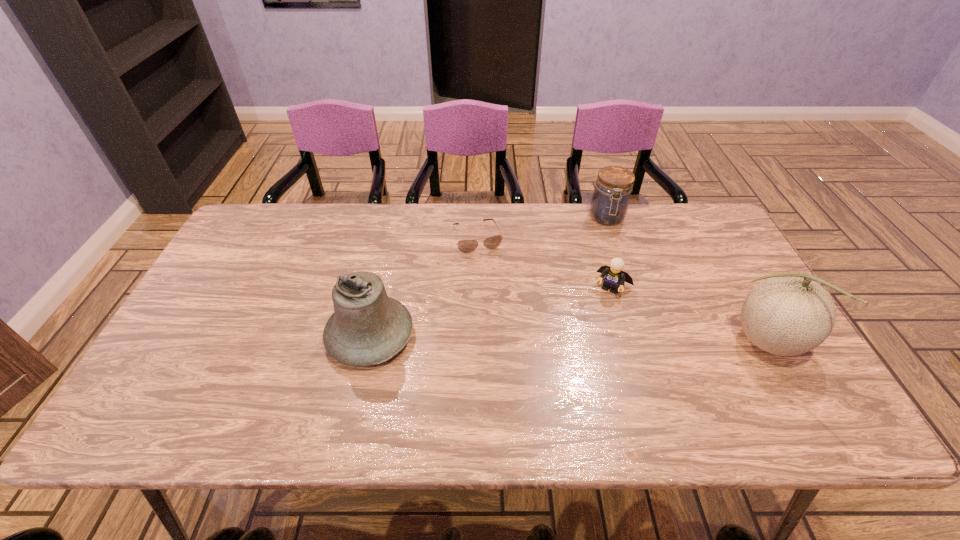
The width and height of the screenshot is (960, 540). I want to click on the fourth shortest object, so click(367, 327).

You are a GUI agent. You are given a task and a screenshot of the screen. Output one action in this format:
    pyautogui.click(x=<x>, y=<y>)
    Task: Click on the leftmost object
    
    Given the screenshot: What is the action you would take?
    pyautogui.click(x=367, y=327)

Find the location of a particular element. This screenshot has height=540, width=960. cantaloup is located at coordinates (788, 314).

This screenshot has height=540, width=960. In order to click on the tallest object in this screenshot , I will do `click(788, 314)`.

Identify the location of sunglasses. (466, 246).

Locate an element on the screen. The height and width of the screenshot is (540, 960). the shortest object is located at coordinates (466, 246).

At what (x,y) coordinates should I click in order to perform the action: click on jar. Please return your answer as a coordinate pair (x, y). This screenshot has width=960, height=540. Looking at the image, I should click on (610, 200).

This screenshot has height=540, width=960. I want to click on Lego, so click(x=614, y=276).

Locate an element on the screen. The width and height of the screenshot is (960, 540). the second shortest object is located at coordinates (614, 276).

The width and height of the screenshot is (960, 540). What are the coordinates of `vacant area situated on the back of the leftmost object` in the screenshot? It's located at (384, 272).